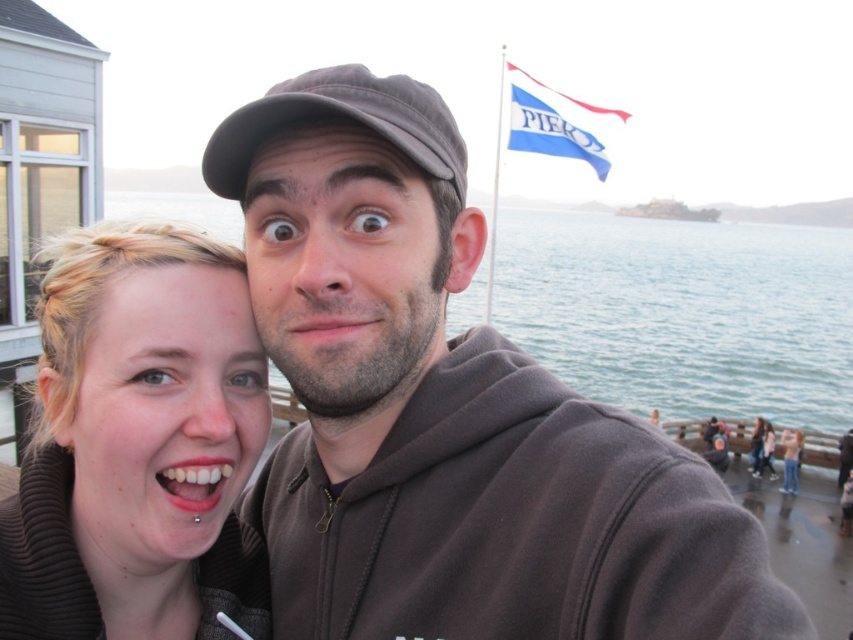
Question: Which point is closer to the camera?

Choices:
 (A) clear blue water at center
 (B) matte skin face at lower left

Answer: (B)

Question: Does matte brown hair at center have a larger size compared to brown matte hoodie at center?

Choices:
 (A) yes
 (B) no

Answer: (A)

Question: Is the position of clear blue water at center less distant than that of brown matte hoodie at center?

Choices:
 (A) yes
 (B) no

Answer: (B)

Question: Which point is farther to the camera?

Choices:
 (A) (144, 506)
 (B) (567, 236)
 (C) (628, 424)
 (D) (7, 580)

Answer: (B)

Question: Which point is closer to the camera taking this photo?

Choices:
 (A) (73, 500)
 (B) (345, 157)
 (C) (345, 205)
 (D) (566, 236)

Answer: (B)

Question: Can you confirm if brown fleece at center is smaller than clear blue water at center?

Choices:
 (A) yes
 (B) no

Answer: (A)